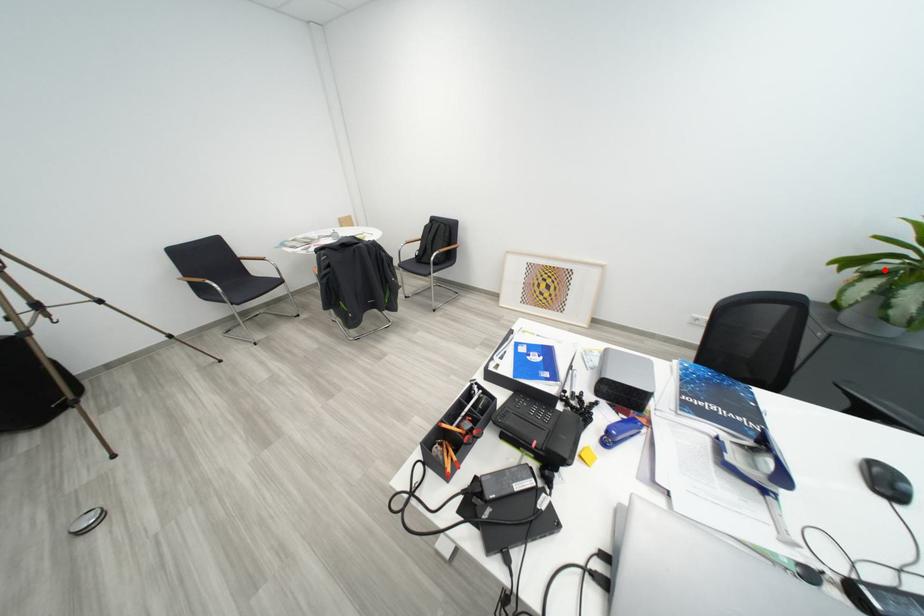
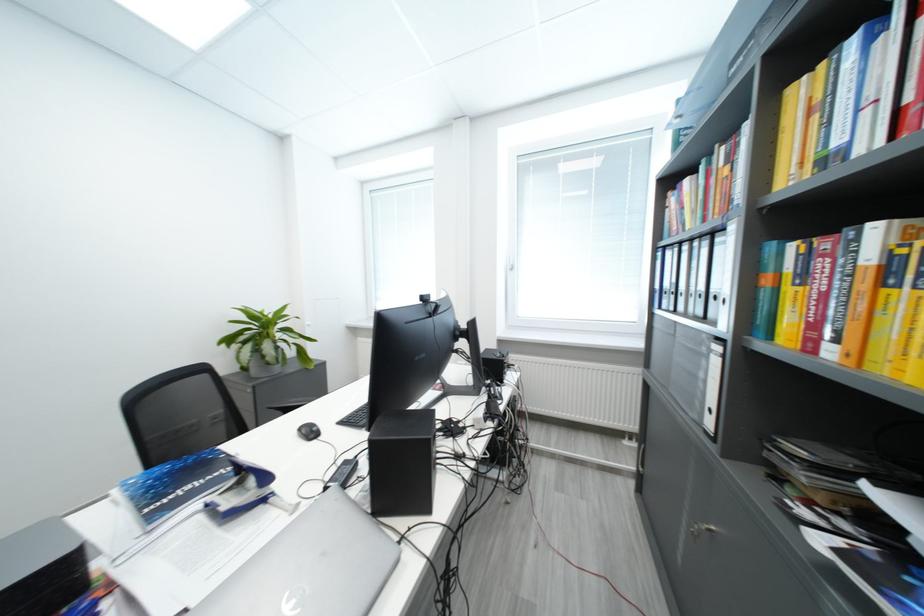
Find the pixel in the second image that matches the highlighted location in the first image.

(251, 341)